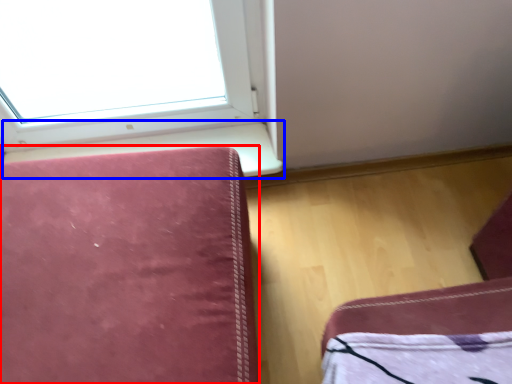
Question: Which object is closer to the camera taking this photo, furniture (highlighted by a red box) or window sill (highlighted by a blue box)?

Choices:
 (A) furniture
 (B) window sill

Answer: (A)